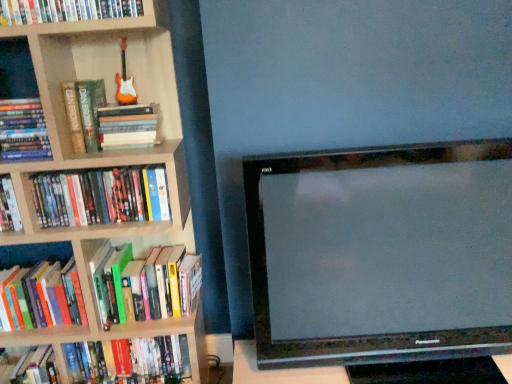
Question: Are hardcover books at left, which is the second book in top-to-bottom order, and hardcover book at left, the 6th book viewed from the top, far apart?

Choices:
 (A) no
 (B) yes

Answer: (A)

Question: Could hardcover book at left, which is the second book from bottom to top, be considered to be inside hardcover books at left, placed as the sixth book when sorted from bottom to top?

Choices:
 (A) no
 (B) yes

Answer: (A)

Question: Considering the relative sizes of hardcover books at left, which is the second book in top-to-bottom order, and hardcover book at left, which is the second book from bottom to top, in the image provided, is hardcover books at left, which is the second book in top-to-bottom order, shorter than hardcover book at left, which is the second book from bottom to top,?

Choices:
 (A) yes
 (B) no

Answer: (A)

Question: From the image's perspective, does hardcover books at left, which is the second book in top-to-bottom order, appear higher than hardcover book at left, which is the second book from bottom to top?

Choices:
 (A) no
 (B) yes

Answer: (B)

Question: Does hardcover books at left, which is the second book in top-to-bottom order, appear on the right side of hardcover book at left, the 6th book viewed from the top?

Choices:
 (A) no
 (B) yes

Answer: (A)

Question: Is hardcover books at left, placed as the sixth book when sorted from bottom to top, outside hardcover book at left, which is the second book from bottom to top?

Choices:
 (A) no
 (B) yes

Answer: (B)

Question: From a real-world perspective, is hardcover book at left positioned over hardcover book at upper left, positioned as the first book in top-to-bottom order, based on gravity?

Choices:
 (A) no
 (B) yes

Answer: (A)

Question: From the image's perspective, does hardcover book at left appear higher than hardcover book at upper left, positioned as the first book in top-to-bottom order?

Choices:
 (A) yes
 (B) no

Answer: (B)

Question: Considering the relative sizes of hardcover book at left and hardcover book at upper left, which is the 7th book from bottom to top, in the image provided, is hardcover book at left shorter than hardcover book at upper left, which is the 7th book from bottom to top,?

Choices:
 (A) no
 (B) yes

Answer: (A)

Question: From a real-world perspective, is hardcover book at left located beneath hardcover book at upper left, which is the 7th book from bottom to top?

Choices:
 (A) yes
 (B) no

Answer: (A)

Question: Is hardcover book at left looking in the opposite direction of hardcover book at upper left, which is the 7th book from bottom to top?

Choices:
 (A) yes
 (B) no

Answer: (B)

Question: Does hardcover book at left have a lesser width compared to hardcover book at upper left, positioned as the first book in top-to-bottom order?

Choices:
 (A) yes
 (B) no

Answer: (B)

Question: Are hardcover book at left, which is counted as the third book, starting from the bottom, and hardcover book at left, the seventh book from the top, located far from each other?

Choices:
 (A) no
 (B) yes

Answer: (A)